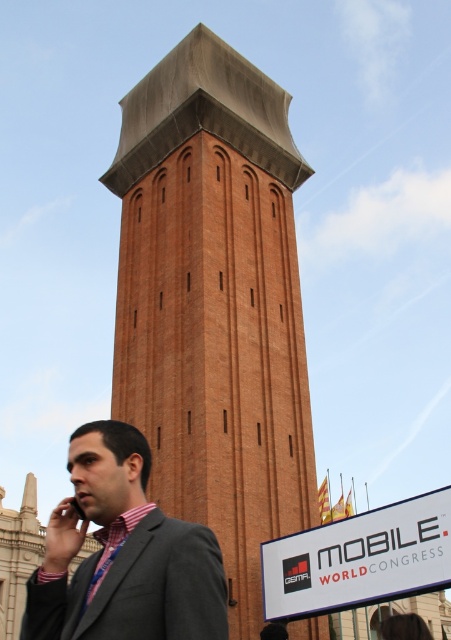
Question: Does brown brick tower at center have a smaller size compared to gray suit at center?

Choices:
 (A) yes
 (B) no

Answer: (B)

Question: Among these points, which one is farthest from the camera?

Choices:
 (A) (128, 435)
 (B) (174, 164)

Answer: (B)

Question: Is brown brick tower at center closer to the viewer compared to gray suit at center?

Choices:
 (A) yes
 (B) no

Answer: (B)

Question: Does brown brick tower at center have a larger size compared to gray suit at center?

Choices:
 (A) no
 (B) yes

Answer: (B)

Question: Which object appears closest to the camera in this image?

Choices:
 (A) brown brick tower at center
 (B) gray suit at center

Answer: (B)